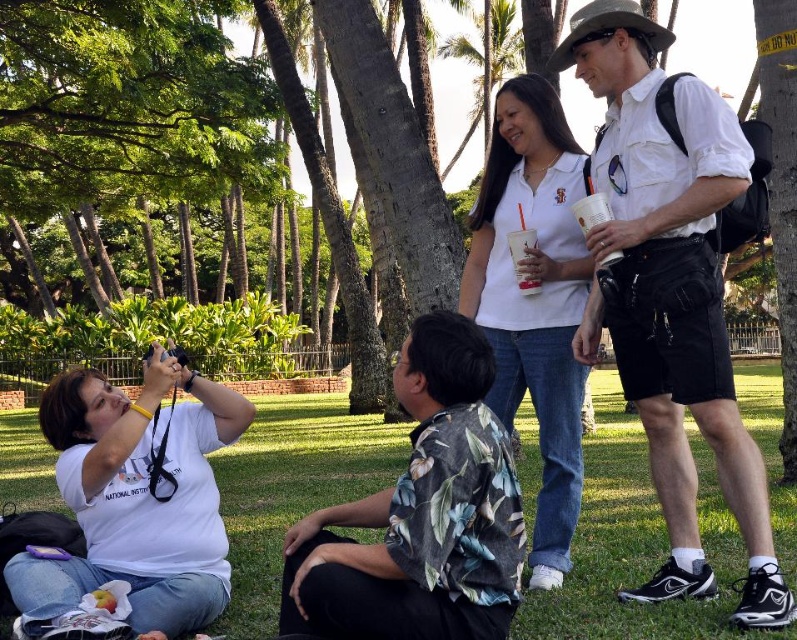
Can you confirm if white cotton shirt at upper right is taller than floral print shirt at center?

Yes.

Who is shorter, white cotton shirt at upper right or floral print shirt at center?

floral print shirt at center

Image resolution: width=797 pixels, height=640 pixels. I want to click on white cotton shirt at upper right, so click(x=670, y=294).

Who is more forward, (413, 362) or (501, 253)?

Point (413, 362)

Can you confirm if floral print shirt at center is thinner than white matte shirt at center?

Incorrect, floral print shirt at center's width is not less than white matte shirt at center's.

Which is behind, point (387, 588) or point (532, 104)?

Point (532, 104)

The image size is (797, 640). In order to click on floral print shirt at center in this screenshot , I will do `click(421, 515)`.

Between green grass at lower center and white matte shirt at center, which one appears on the left side from the viewer's perspective?

From the viewer's perspective, white matte shirt at center appears more on the left side.

Which is more to the right, green grass at lower center or white matte shirt at center?

From the viewer's perspective, green grass at lower center appears more on the right side.

Locate an element on the screen. This screenshot has height=640, width=797. green grass at lower center is located at coordinates (634, 545).